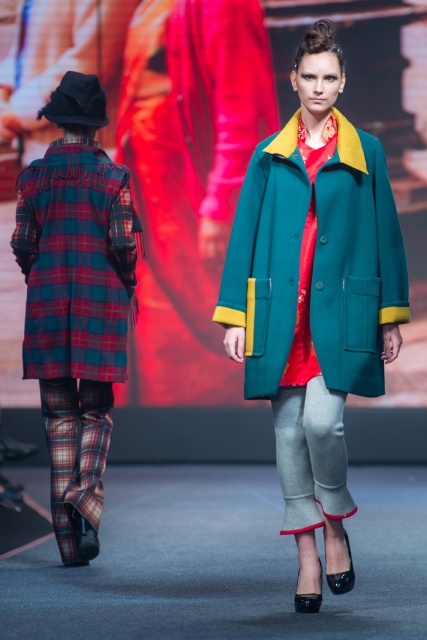
You are a fashion designer observing the runway show. You need to adjust the positioning of the plaid wool coat at left and the teal woolen coat at center for a better visual flow. Based on their current positions, which coat is positioned lower in the image?

The plaid wool coat at left is located below the teal woolen coat at center, so it is positioned lower in the image.

You are a photographer at the runway show. You need to capture a photo where both the teal woolen coat at center and the red plaid coat at back are visible. Based on their positions, which coat should you focus on first to ensure both are in frame?

The teal woolen coat at center is positioned on the right side of the red plaid coat at back. To ensure both are in frame, focus on the teal woolen coat at center first, then adjust to include the red plaid coat at back on the left side.